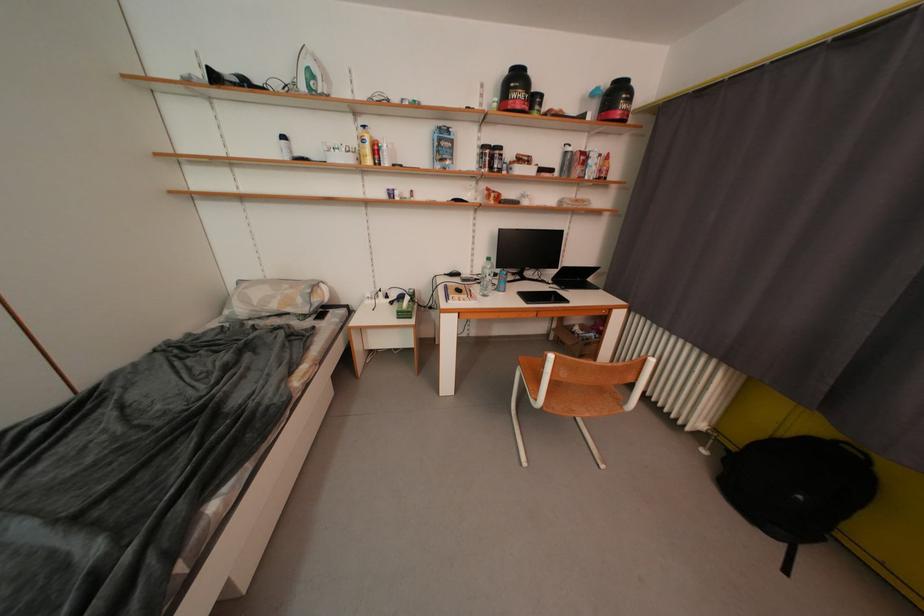
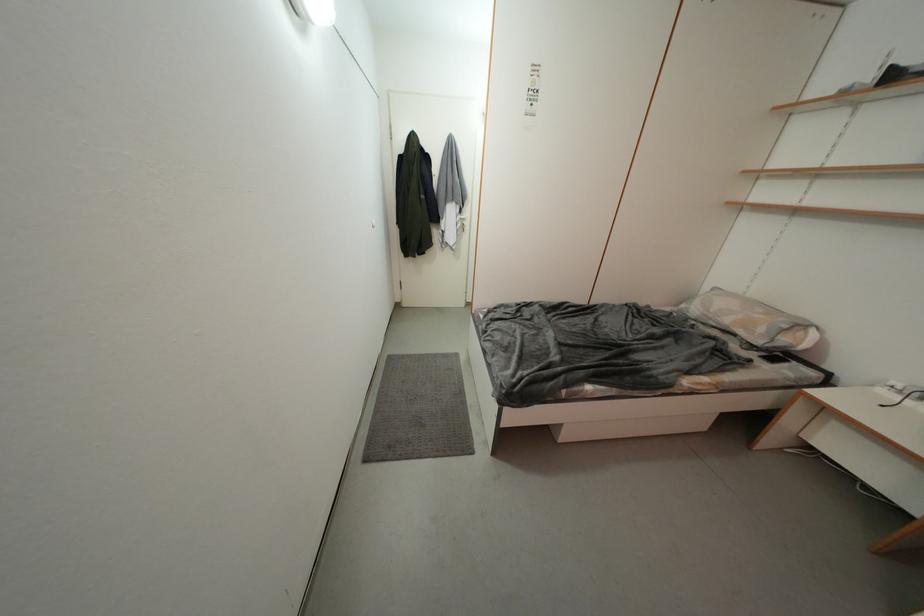
Locate, in the second image, the point that corresponds to (x=307, y=304) in the first image.

(769, 333)